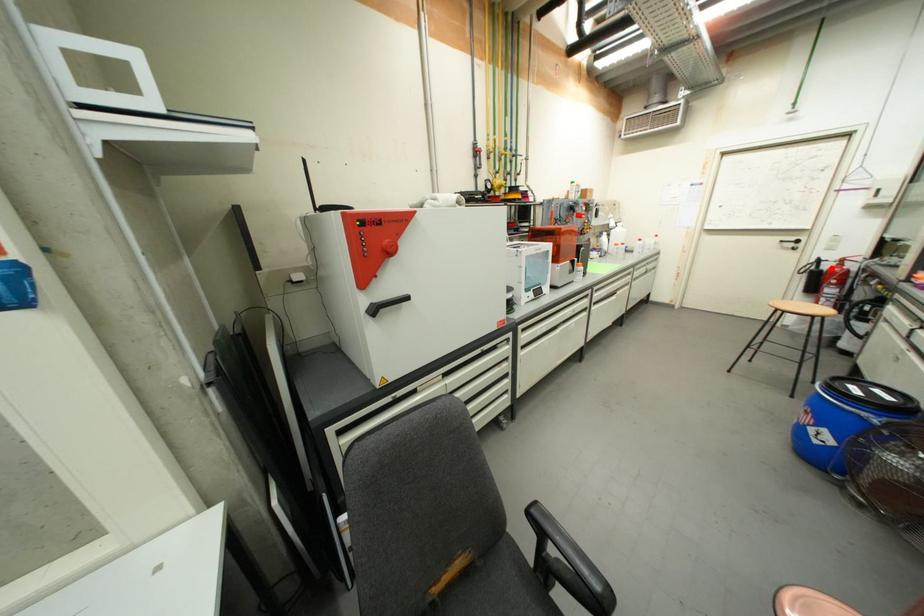
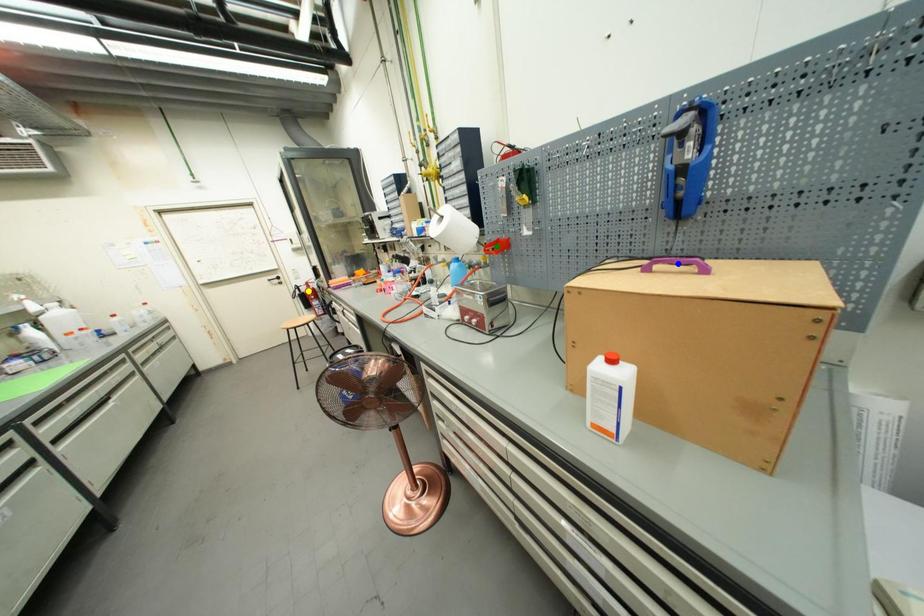
Question: I am providing you with two images of the same scene from different viewpoints. A red point is marked on the first image. You are given multiple points on the second image. Which point in image 2 represents the same 3d spot as the red point in image 1?

Choices:
 (A) green point
 (B) blue point
 (C) yellow point

Answer: (C)